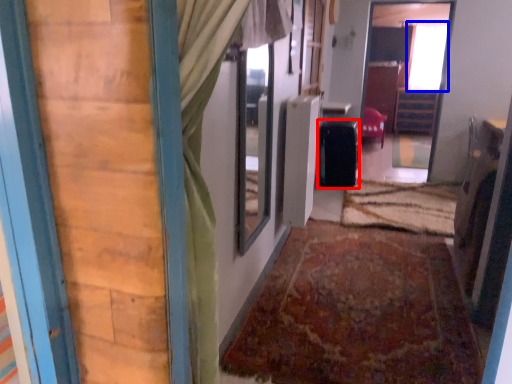
Question: Which object is further to the camera taking this photo, luggage (highlighted by a red box) or window (highlighted by a blue box)?

Choices:
 (A) luggage
 (B) window

Answer: (B)